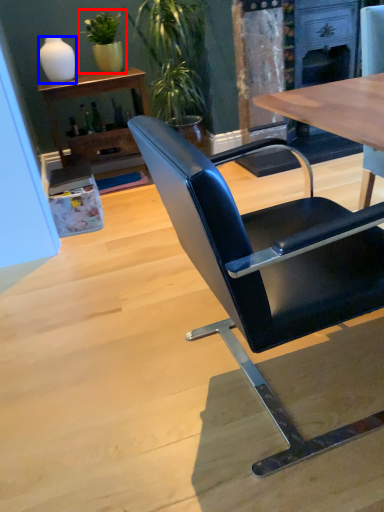
Question: Which point is further to the camera, houseplant (highlighted by a red box) or vase (highlighted by a blue box)?

Choices:
 (A) houseplant
 (B) vase

Answer: (A)